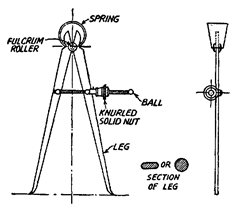
Locate an element on the screen. This screenshot has width=240, height=206. leg tips is located at coordinates (32, 191), (110, 192).